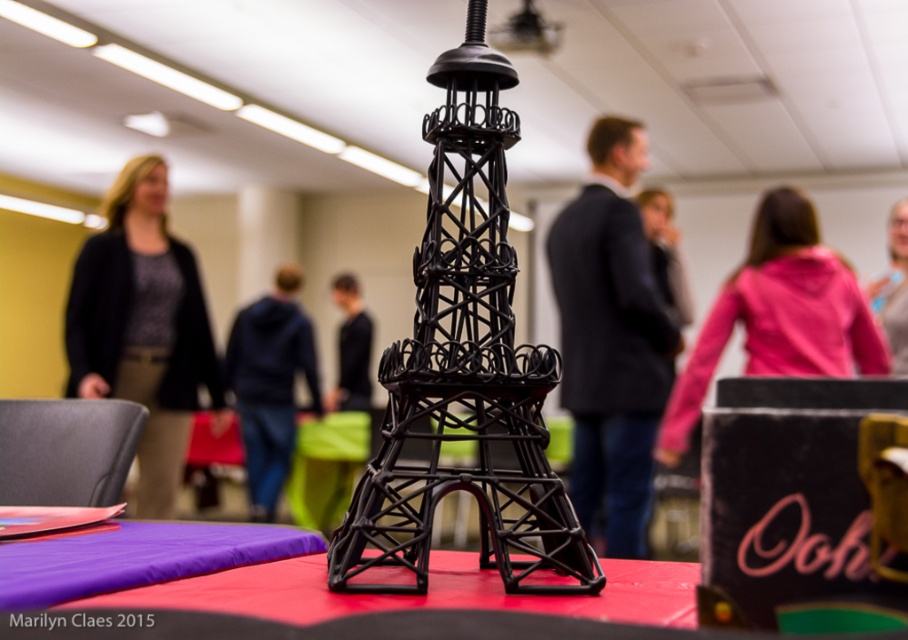
In the scene shown: Is matte black sweater at left in front of rubberized red tablecloth at center?

No.

Is point (134, 378) positioned before point (255, 611)?

No, it is behind (255, 611).

Find the location of `matte black sweater at left`. matte black sweater at left is located at coordinates (143, 326).

Measure the distance from black matte eiffel tower at center to matte black sweater at left.

A distance of 6.87 feet exists between black matte eiffel tower at center and matte black sweater at left.

Who is more forward, (536, 371) or (75, 307)?

Point (536, 371)

Does point (448, 154) come farther from viewer compared to point (114, 268)?

No, it is not.

Identify the location of black matte eiffel tower at center. The width and height of the screenshot is (908, 640). (465, 369).

Between black matte eiffel tower at center and pink fabric at center, which one has more height?

Standing taller between the two is pink fabric at center.

Does black matte eiffel tower at center have a smaller size compared to pink fabric at center?

Indeed, black matte eiffel tower at center has a smaller size compared to pink fabric at center.

Is point (551, 355) more distant than point (668, 408)?

No.

You are a GUI agent. You are given a task and a screenshot of the screen. Output one action in this format:
    pyautogui.click(x=<x>, y=<y>)
    Task: Click on the black matte eiffel tower at center
    
    Given the screenshot: What is the action you would take?
    pyautogui.click(x=465, y=369)